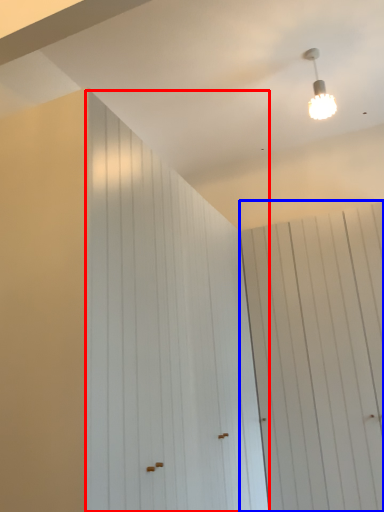
Question: Which object is further to the camera taking this photo, barn door (highlighted by a red box) or barn door (highlighted by a blue box)?

Choices:
 (A) barn door
 (B) barn door

Answer: (B)